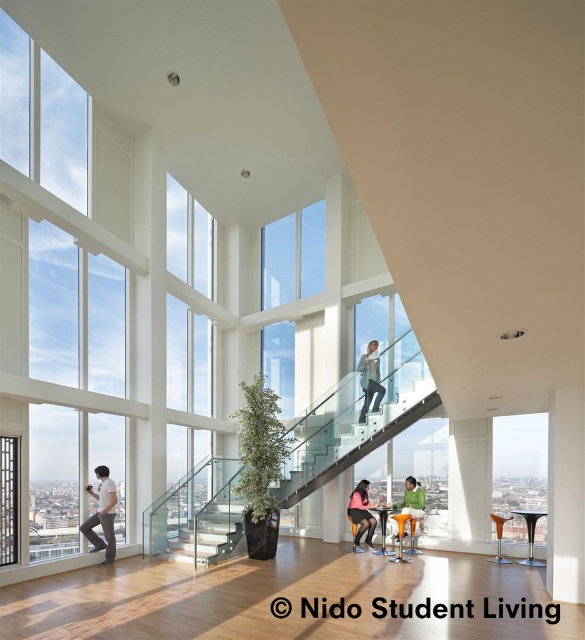
Question: Does transparent glass window at upper center appear on the right side of clear glass window at lower left?

Choices:
 (A) yes
 (B) no

Answer: (A)

Question: Does transparent glass window at upper center lie behind clear glass window at lower left?

Choices:
 (A) no
 (B) yes

Answer: (B)

Question: Can you confirm if white matte shirt at left is positioned above black glass table at center?

Choices:
 (A) no
 (B) yes

Answer: (B)

Question: Which point is farther to the camera?

Choices:
 (A) (5, 490)
 (B) (109, 561)
 (C) (414, 506)
 (D) (319, 211)

Answer: (D)

Question: Which object is the closest to the clear glass window at lower left?

Choices:
 (A) black glass table at center
 (B) white matte shirt at left

Answer: (B)

Question: Which object appears closest to the camera in this image?

Choices:
 (A) clear glass window at lower left
 (B) matte black shorts at center
 (C) black glass table at center
 (D) glass/stainless steel staircase at center

Answer: (A)